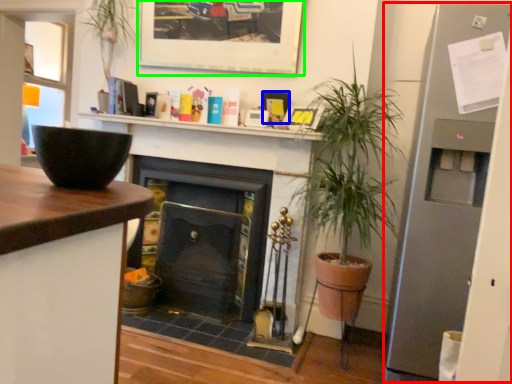
Question: Which object is positioned closest to fridge (highlighted by a red box)? Select from picture frame (highlighted by a blue box) and picture frame (highlighted by a green box).

Choices:
 (A) picture frame
 (B) picture frame

Answer: (A)